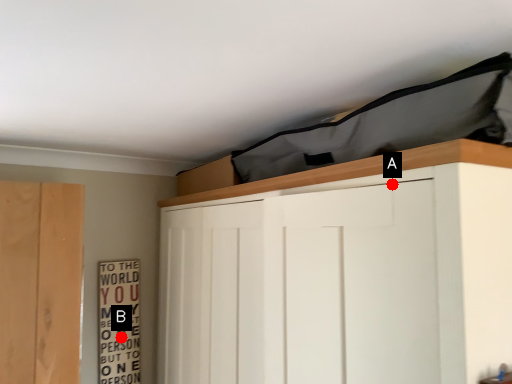
Question: Two points are circled on the image, labeled by A and B beside each circle. Which of the following is the closest to the observer?

Choices:
 (A) A is closer
 (B) B is closer

Answer: (A)